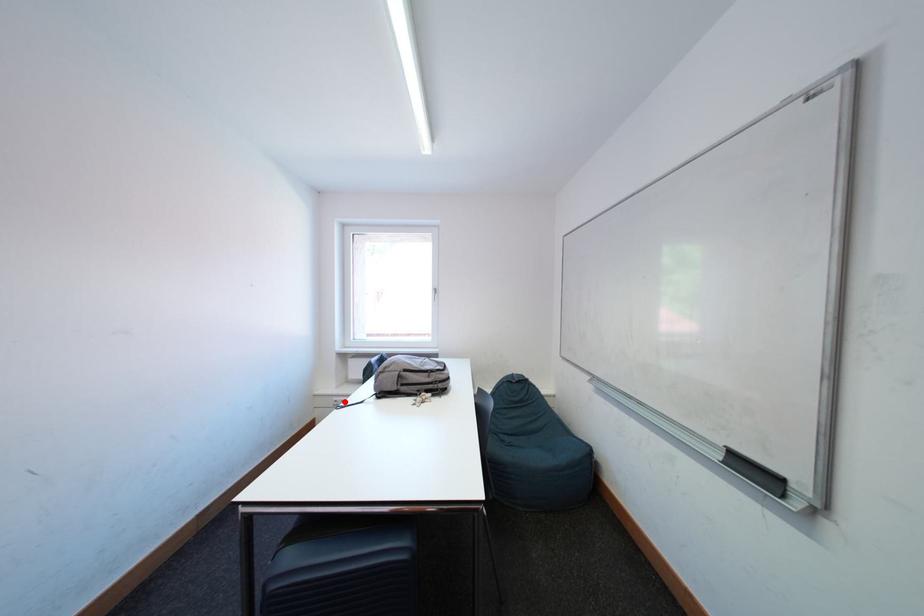
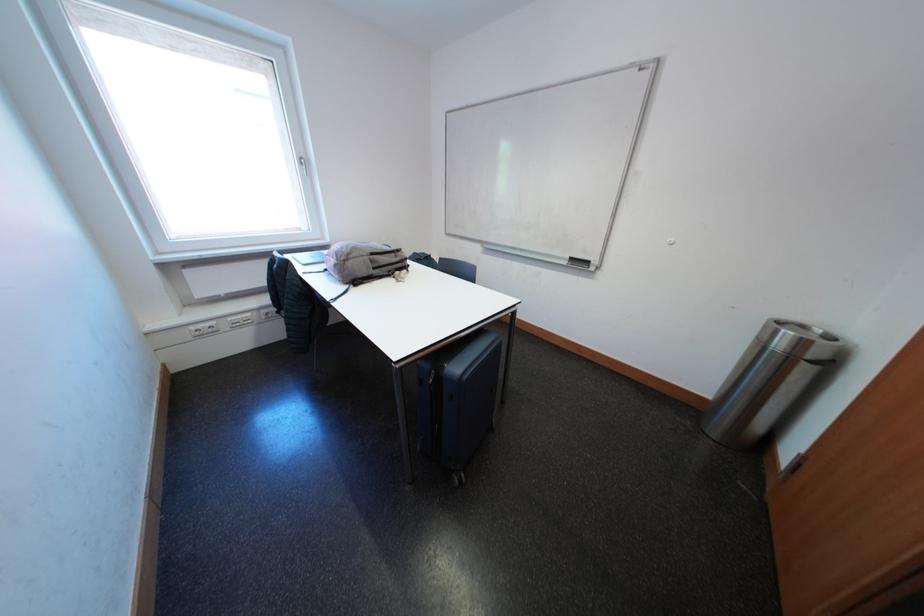
Question: A red point is marked in image1. In image2, is the corresponding 3D point closer to the camera or farther? Reply with the corresponding letter.

Choices:
 (A) The corresponding 3D point is closer.
 (B) The corresponding 3D point is farther.

Answer: (A)